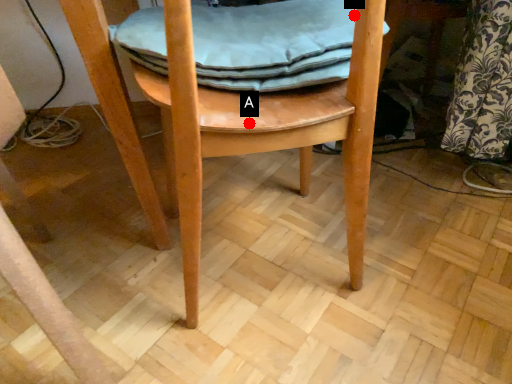
Question: Two points are circled on the image, labeled by A and B beside each circle. Which point appears closest to the camera in this image?

Choices:
 (A) A is closer
 (B) B is closer

Answer: (A)